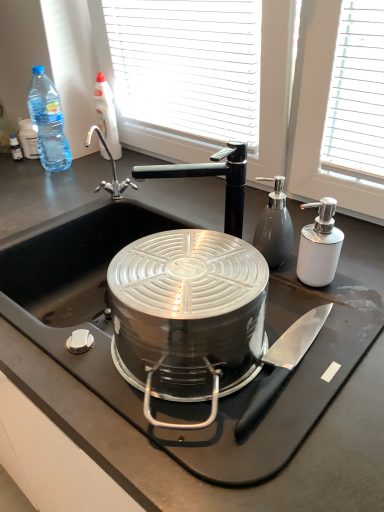
Find the location of a particular element. The height and width of the screenshot is (512, 384). free space in front of blue plastic bottle at upper left, the second bottle when ordered from back to front is located at coordinates (47, 186).